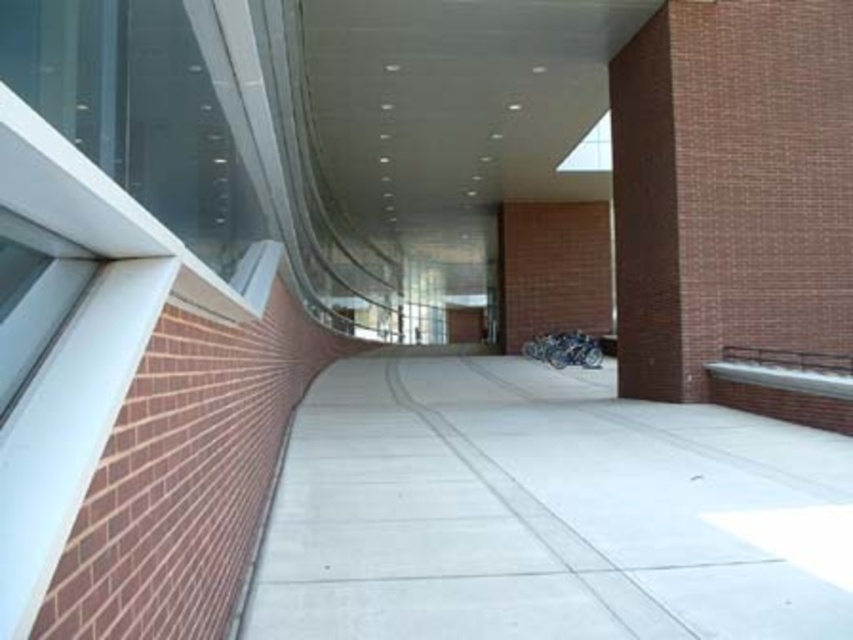
Question: Which is nearer to the brown brick pillar at right?

Choices:
 (A) transparent glass window at upper center
 (B) concrete at center

Answer: (B)

Question: Which of these objects is positioned closest to the brown brick pillar at right?

Choices:
 (A) concrete at center
 (B) transparent glass window at upper center

Answer: (A)

Question: From the image, what is the correct spatial relationship of concrete at center in relation to transparent glass window at upper center?

Choices:
 (A) right
 (B) left

Answer: (B)

Question: Which point is closer to the camera taking this photo?

Choices:
 (A) (518, 556)
 (B) (602, 115)

Answer: (A)

Question: Does concrete at center have a lesser width compared to brown brick pillar at right?

Choices:
 (A) yes
 (B) no

Answer: (B)

Question: Is concrete at center positioned behind brown brick pillar at right?

Choices:
 (A) yes
 (B) no

Answer: (B)